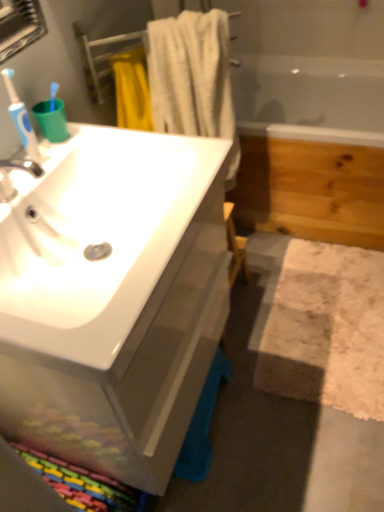
Question: Considering the relative sizes of white glossy sink at left and blue plastic toothbrush at left in the image provided, is white glossy sink at left taller than blue plastic toothbrush at left?

Choices:
 (A) no
 (B) yes

Answer: (B)

Question: Is the position of white glossy sink at left less distant than that of blue plastic toothbrush at left?

Choices:
 (A) yes
 (B) no

Answer: (A)

Question: Is white glossy sink at left located outside blue plastic toothbrush at left?

Choices:
 (A) no
 (B) yes

Answer: (B)

Question: From the image's perspective, is white glossy sink at left below blue plastic toothbrush at left?

Choices:
 (A) no
 (B) yes

Answer: (B)

Question: Is white glossy sink at left beside blue plastic toothbrush at left?

Choices:
 (A) no
 (B) yes

Answer: (A)

Question: Would you say blue plastic toothbrush at left is part of white glossy sink at left's contents?

Choices:
 (A) yes
 (B) no

Answer: (B)

Question: Is white cotton towel at upper center facing away from white glossy sink at left?

Choices:
 (A) no
 (B) yes

Answer: (A)

Question: Is white cotton towel at upper center located outside white glossy sink at left?

Choices:
 (A) yes
 (B) no

Answer: (A)

Question: Is the position of white cotton towel at upper center more distant than that of white glossy sink at left?

Choices:
 (A) no
 (B) yes

Answer: (B)

Question: Is the surface of white cotton towel at upper center in direct contact with white glossy sink at left?

Choices:
 (A) no
 (B) yes

Answer: (A)

Question: Is white cotton towel at upper center taller than white glossy sink at left?

Choices:
 (A) no
 (B) yes

Answer: (A)

Question: Is white cotton towel at upper center aimed at white glossy sink at left?

Choices:
 (A) yes
 (B) no

Answer: (B)

Question: Does white textured bath mat at lower right have a greater height compared to blue plastic toothbrush at left?

Choices:
 (A) yes
 (B) no

Answer: (B)